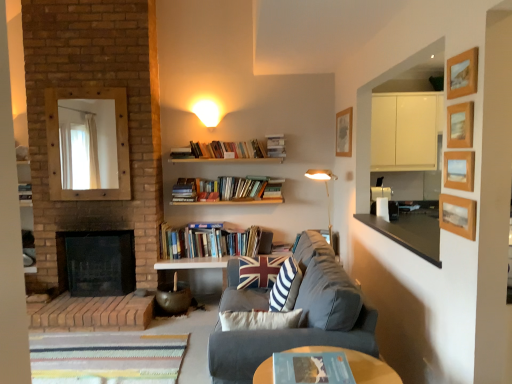
Question: Considering their positions, is dark gray fabric couch at center located in front of or behind wooden picture frame at upper right, which ranks as the 3th picture frame in top-to-bottom order?

Choices:
 (A) front
 (B) behind

Answer: (B)

Question: From a real-world perspective, is dark gray fabric couch at center positioned above or below wooden picture frame at upper right, placed as the 2th picture frame when sorted from back to front?

Choices:
 (A) below
 (B) above

Answer: (A)

Question: Considering the real-world distances, which object is closest to the brick fireplace at left?

Choices:
 (A) wooden picture frame at upper right, the third picture frame positioned from the bottom
 (B) striped fabric throw pillow at center
 (C) union jack fabric pillow at center
 (D) wooden mirror at upper left
 (E) wooden picture frame at upper right, which appears as the 2th picture frame when viewed from the front

Answer: (D)

Question: Based on their relative distances, which object is farther from the brick fireplace at left?

Choices:
 (A) wooden picture frame at upper right, placed as the 4th picture frame when sorted from back to front
 (B) matte white wall sconce at upper center
 (C) striped fabric throw pillow at center
 (D) wooden picture frame at upper right, the fourth picture frame ordered from the bottom
 (E) hardcover book at upper center, the first book in the top-to-bottom sequence

Answer: (D)